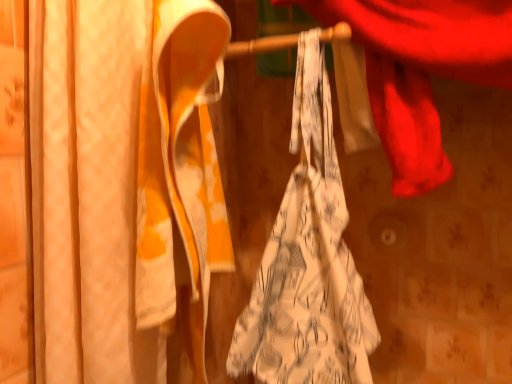
Where is `matte white curtain at left`? matte white curtain at left is located at coordinates (126, 180).

Image resolution: width=512 pixels, height=384 pixels. What do you see at coordinates (126, 180) in the screenshot?
I see `matte white curtain at left` at bounding box center [126, 180].

You are a GUI agent. You are given a task and a screenshot of the screen. Output one action in this format:
    pyautogui.click(x=<x>, y=<y>)
    Task: Click on the white printed fabric at center
    The height and width of the screenshot is (384, 512).
    Given the screenshot: What is the action you would take?
    pyautogui.click(x=308, y=260)

Describe the element at coordinates (308, 260) in the screenshot. I see `white printed fabric at center` at that location.

Where is `matte white curtain at left`? This screenshot has width=512, height=384. matte white curtain at left is located at coordinates (126, 180).

Would you say matte white curtain at left is to the left or to the right of white printed fabric at center in the picture?

From the image, it's evident that matte white curtain at left is to the left of white printed fabric at center.

Considering the positions of objects matte white curtain at left and white printed fabric at center in the image provided, who is behind, matte white curtain at left or white printed fabric at center?

Positioned behind is white printed fabric at center.

Does point (190, 219) come farther from viewer compared to point (305, 332)?

No, (190, 219) is closer to viewer.

From the image's perspective, between matte white curtain at left and white printed fabric at center, who is located below?

From the image's view, white printed fabric at center is below.

From a real-world perspective, which is physically below, matte white curtain at left or white printed fabric at center?

white printed fabric at center.

Is matte white curtain at left wider than white printed fabric at center?

Indeed, matte white curtain at left has a greater width compared to white printed fabric at center.

Can you confirm if matte white curtain at left is shorter than white printed fabric at center?

No.

Is matte white curtain at left bigger than white printed fabric at center?

No.

Is matte white curtain at left positioned beyond the bounds of white printed fabric at center?

Yes, matte white curtain at left is located beyond the bounds of white printed fabric at center.

Does matte white curtain at left touch white printed fabric at center?

No, matte white curtain at left is not touching white printed fabric at center.

Based on the photo, could you tell me if matte white curtain at left is facing white printed fabric at center?

No, matte white curtain at left is not oriented towards white printed fabric at center.

What's the angular difference between matte white curtain at left and white printed fabric at center's facing directions?

matte white curtain at left and white printed fabric at center are facing 13 degrees away from each other.

This screenshot has width=512, height=384. I want to click on curtain in front of the white printed fabric at center, so click(x=126, y=180).

Is white printed fabric at center to the left or to the right of matte white curtain at left in the image?

From the image, it's evident that white printed fabric at center is to the right of matte white curtain at left.

Which is behind, white printed fabric at center or matte white curtain at left?

Positioned behind is white printed fabric at center.

Considering the positions of point (336, 356) and point (198, 150), is point (336, 356) closer or farther from the camera than point (198, 150)?

Point (336, 356).

From the image's perspective, does white printed fabric at center appear higher than matte white curtain at left?

No, from the image's perspective, white printed fabric at center is not over matte white curtain at left.

From a real-world perspective, is white printed fabric at center under matte white curtain at left?

Indeed, from a real-world perspective, white printed fabric at center is positioned beneath matte white curtain at left.

Looking at this image, considering the sizes of objects white printed fabric at center and matte white curtain at left in the image provided, who is thinner, white printed fabric at center or matte white curtain at left?

Thinner between the two is white printed fabric at center.

Is white printed fabric at center taller than matte white curtain at left?

Incorrect, the height of white printed fabric at center is not larger of that of matte white curtain at left.

Looking at this image, who is smaller, white printed fabric at center or matte white curtain at left?

With smaller size is matte white curtain at left.

Is matte white curtain at left located within white printed fabric at center?

No, matte white curtain at left is not a part of white printed fabric at center.

Is the surface of white printed fabric at center in direct contact with matte white curtain at left?

white printed fabric at center is not next to matte white curtain at left, and they're not touching.

Is white printed fabric at center positioned with its back to matte white curtain at left?

No, matte white curtain at left is not at the back of white printed fabric at center.

How much distance is there between white printed fabric at center and matte white curtain at left?

white printed fabric at center is 8.78 inches away from matte white curtain at left.

You are a GUI agent. You are given a task and a screenshot of the screen. Output one action in this format:
    pyautogui.click(x=<x>, y=<y>)
    Task: Click on the towel below the matte white curtain at left (from the image's perspective)
    
    Given the screenshot: What is the action you would take?
    pyautogui.click(x=308, y=260)

Find the location of a particular element. towel that appears below the matte white curtain at left (from a real-world perspective) is located at coordinates (308, 260).

You are a GUI agent. You are given a task and a screenshot of the screen. Output one action in this format:
    pyautogui.click(x=<x>, y=<y>)
    Task: Click on the curtain on the left of white printed fabric at center
    The image size is (512, 384).
    Given the screenshot: What is the action you would take?
    pyautogui.click(x=126, y=180)